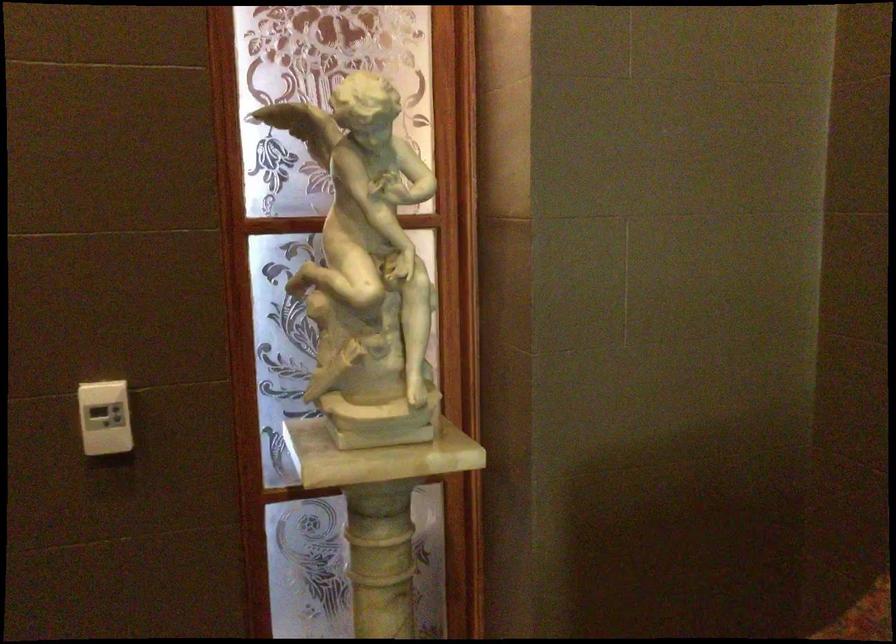
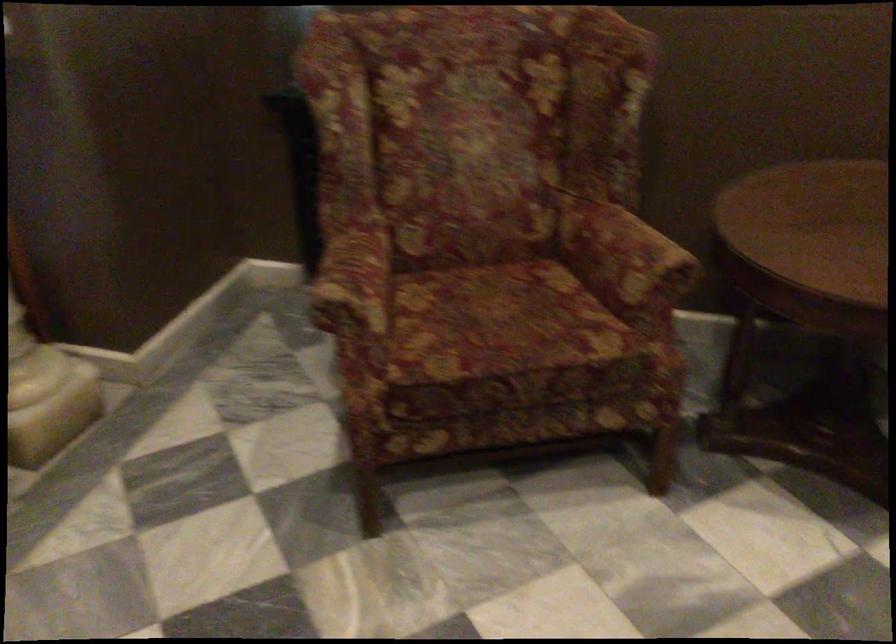
Based on the continuous images, in which direction is the camera rotating?

The camera's rotation is toward right-down.